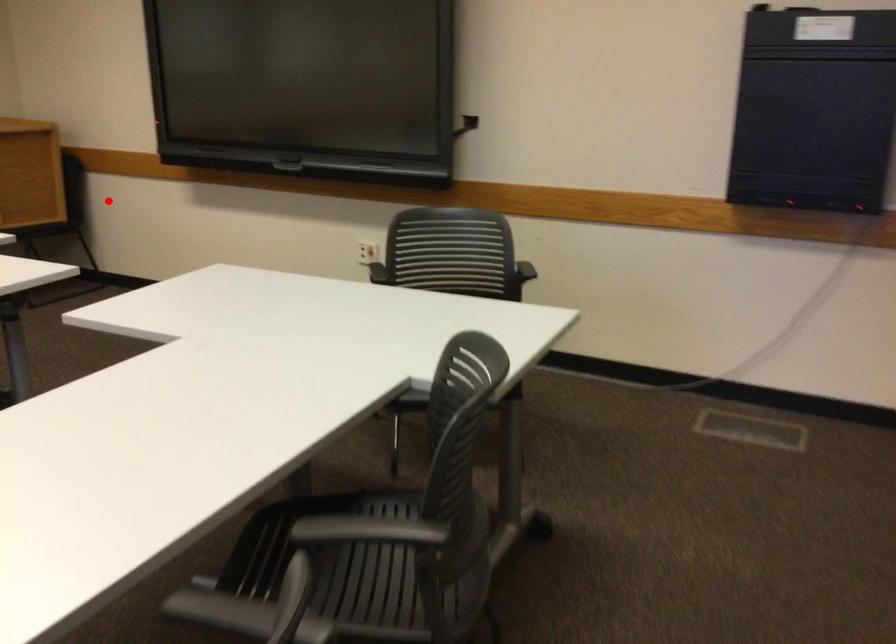
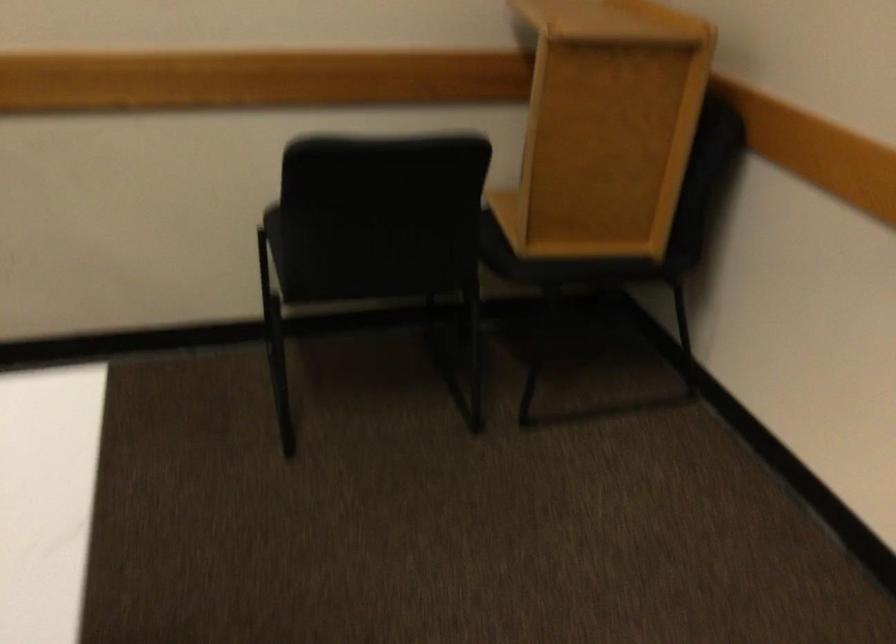
Question: I am providing you with two images of the same scene from different viewpoints. A red point is marked on the first image. At the location where the point appears in image 1, is it still visible in image 2?

Choices:
 (A) Yes
 (B) No

Answer: (A)